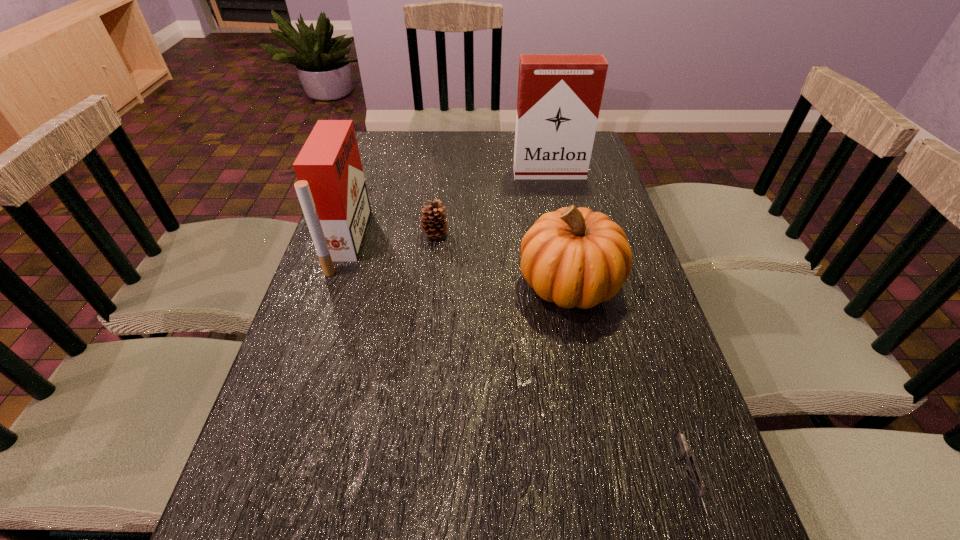
At what (x,y) coordinates should I click in order to perform the action: click on empty space between the second shortest object and the shorter cigarette case. Please return your answer as a coordinate pair (x, y). The image size is (960, 540). Looking at the image, I should click on (392, 238).

The image size is (960, 540). I want to click on the second closest object to the right cigarette case, so click(x=575, y=257).

Select which object appears as the fourth closest to the right cigarette case. Please provide its 2D coordinates. Your answer should be formatted as a tuple, i.e. [(x, y)], where the tuple contains the x and y coordinates of a point satisfying the conditions above.

[(692, 466)]

Locate an element on the screen. vacant space that satisfies the following two spatial constraints: 1. on the front-facing side of the third shortest object; 2. on the left side of the leftmost object is located at coordinates (334, 284).

You are a GUI agent. You are given a task and a screenshot of the screen. Output one action in this format:
    pyautogui.click(x=<x>, y=<y>)
    Task: Click on the free location that satisfies the following two spatial constraints: 1. on the front-facing side of the leftmost object; 2. on the back side of the third tallest object
    This screenshot has width=960, height=540.
    Given the screenshot: What is the action you would take?
    pyautogui.click(x=334, y=284)

Locate an element on the screen. Image resolution: width=960 pixels, height=540 pixels. vacant space that satisfies the following two spatial constraints: 1. on the front-facing side of the third shortest object; 2. on the left side of the left cigarette case is located at coordinates (334, 284).

This screenshot has height=540, width=960. What are the coordinates of `vacant space that satisfies the following two spatial constraints: 1. on the front-facing side of the third tallest object; 2. on the left side of the left cigarette case` in the screenshot? It's located at (334, 284).

Locate an element on the screen. This screenshot has width=960, height=540. free location that satisfies the following two spatial constraints: 1. on the front-facing side of the third shortest object; 2. on the right side of the left cigarette case is located at coordinates (334, 284).